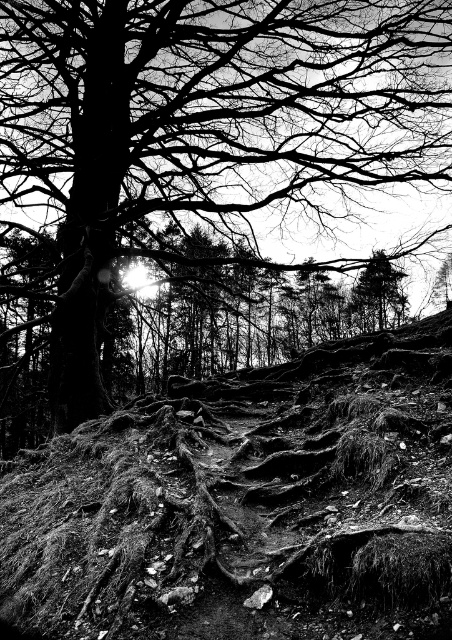
You are standing at the base of the large tree with exposed roots in the photograph. You notice two points marked in the image. The first point is at coordinates point (395, 625) and the second is at point (366, 316). If you were to walk towards the first point, would you pass by the second point before reaching it?

Point (395, 625) is in front of point (366, 316), so walking towards the first point would mean you do not pass by the second point since it is behind the first one.